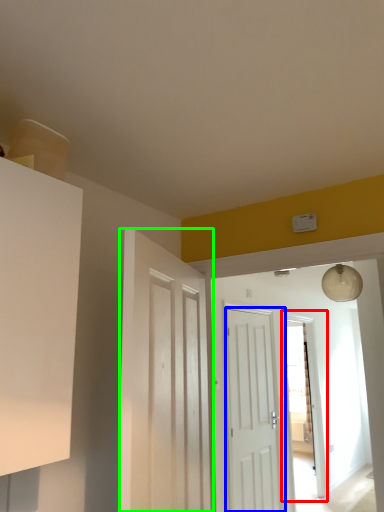
Question: Estimate the real-world distances between objects in this image. Which object is closer to glass door (highlighted by a red box), door (highlighted by a blue box) or door (highlighted by a green box)?

Choices:
 (A) door
 (B) door

Answer: (A)